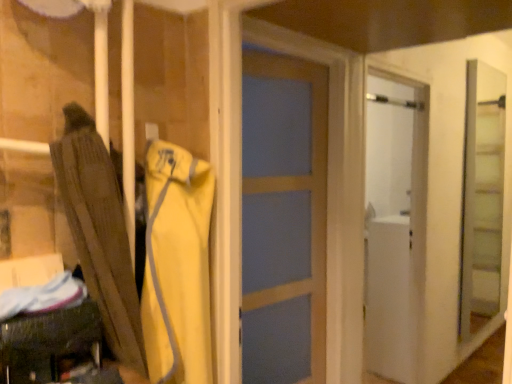
Question: Is clear glass screen door at right facing away from yellow fabric jacket at center?

Choices:
 (A) yes
 (B) no

Answer: (B)

Question: Does clear glass screen door at right have a greater width compared to yellow fabric jacket at center?

Choices:
 (A) yes
 (B) no

Answer: (B)

Question: Does clear glass screen door at right appear on the left side of yellow fabric jacket at center?

Choices:
 (A) yes
 (B) no

Answer: (B)

Question: Is clear glass screen door at right far away from yellow fabric jacket at center?

Choices:
 (A) no
 (B) yes

Answer: (B)

Question: Is clear glass screen door at right shorter than yellow fabric jacket at center?

Choices:
 (A) yes
 (B) no

Answer: (B)

Question: Does clear glass screen door at right come behind yellow fabric jacket at center?

Choices:
 (A) yes
 (B) no

Answer: (A)

Question: Is white matte refrigerator at right not close to brown fabric umbrella at left?

Choices:
 (A) yes
 (B) no

Answer: (A)

Question: Considering the relative positions of white matte refrigerator at right and brown fabric umbrella at left in the image provided, is white matte refrigerator at right to the right of brown fabric umbrella at left from the viewer's perspective?

Choices:
 (A) no
 (B) yes

Answer: (B)

Question: From a real-world perspective, is white matte refrigerator at right located higher than brown fabric umbrella at left?

Choices:
 (A) no
 (B) yes

Answer: (A)

Question: Does white matte refrigerator at right appear on the left side of brown fabric umbrella at left?

Choices:
 (A) no
 (B) yes

Answer: (A)

Question: Can you confirm if white matte refrigerator at right is wider than brown fabric umbrella at left?

Choices:
 (A) yes
 (B) no

Answer: (A)

Question: From the image's perspective, is white matte refrigerator at right over brown fabric umbrella at left?

Choices:
 (A) no
 (B) yes

Answer: (A)

Question: Can you confirm if clear glass screen door at right is wider than brown fabric umbrella at left?

Choices:
 (A) no
 (B) yes

Answer: (A)